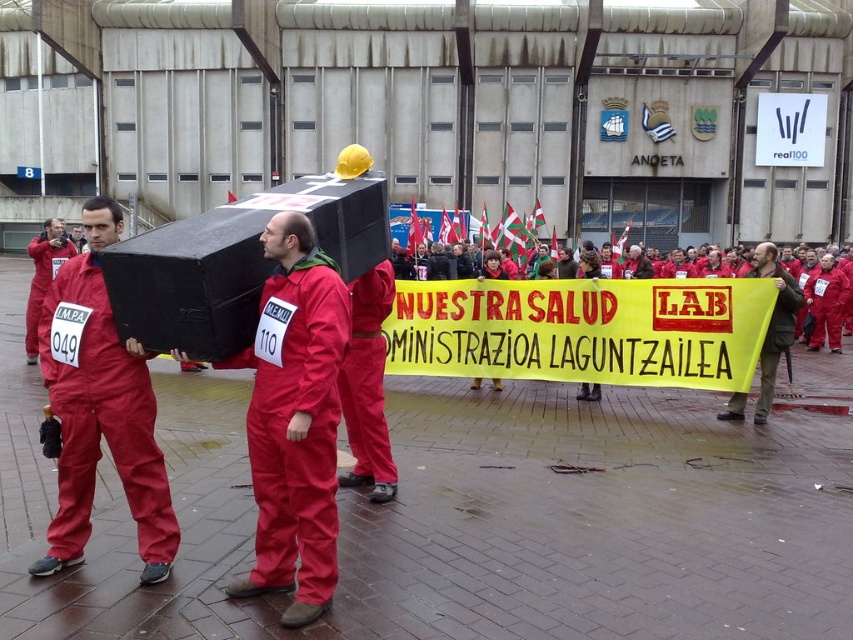
You are a photographer standing at the front of the protest scene. You want to capture a closeup shot of the black coffin being carried by the individuals in red jumpsuits. Since you can only focus on one point at a time, which point should you focus on to ensure the coffin is in sharp focus? The points are labeled as point 049 at coordinate point (786, 301) and point 050 at coordinate point (25, 316).

You should focus on point 049 at coordinate point (786, 301) because it is closer to the camera than point 050 at coordinate point (25, 316). Since the photographer wants the coffin in sharp focus, focusing on the closer point ensures better clarity.

You are a photographer standing at the edge of the protest area. You need to capture a photo that includes both the matte red jumpsuit at center and the matte red jumpsuit at left. Given that your camera has a maximum focus range of 20 meters, will you be able to take a photo that clearly shows both subjects?

The matte red jumpsuit at center is 19.66 meters from the matte red jumpsuit at left. Since the distance between them is within the camera maximum focus range of 20 meters, you can take a photo that clearly shows both subjects.